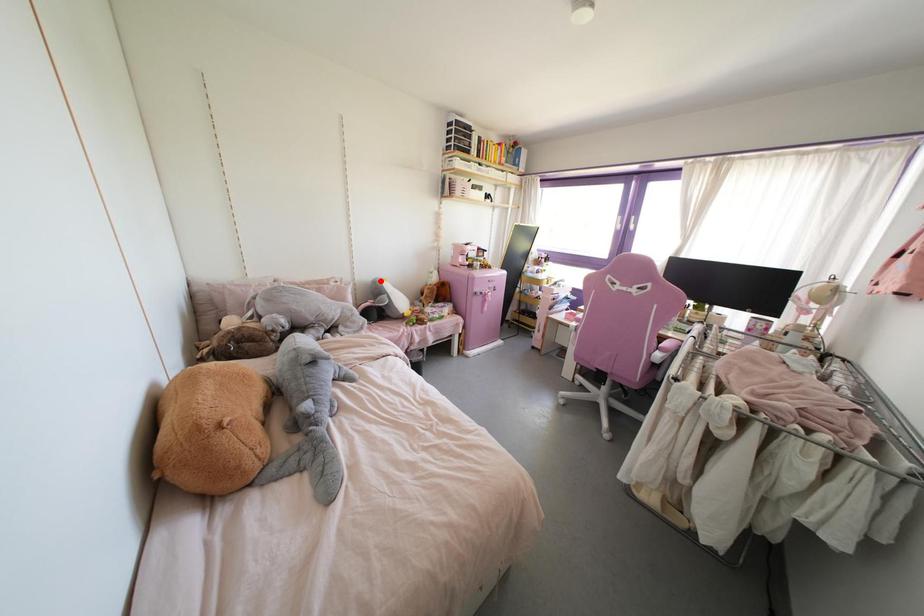
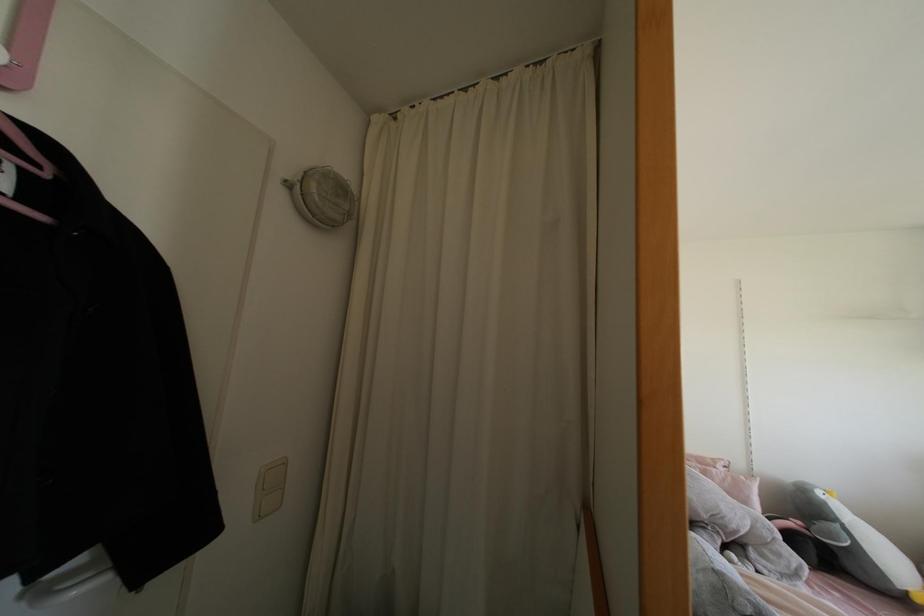
Question: I am providing you with two images of the same scene from different viewpoints. A red point is marked on the first image. Can you still see the location of the red point in image 2?

Choices:
 (A) Yes
 (B) No

Answer: (A)